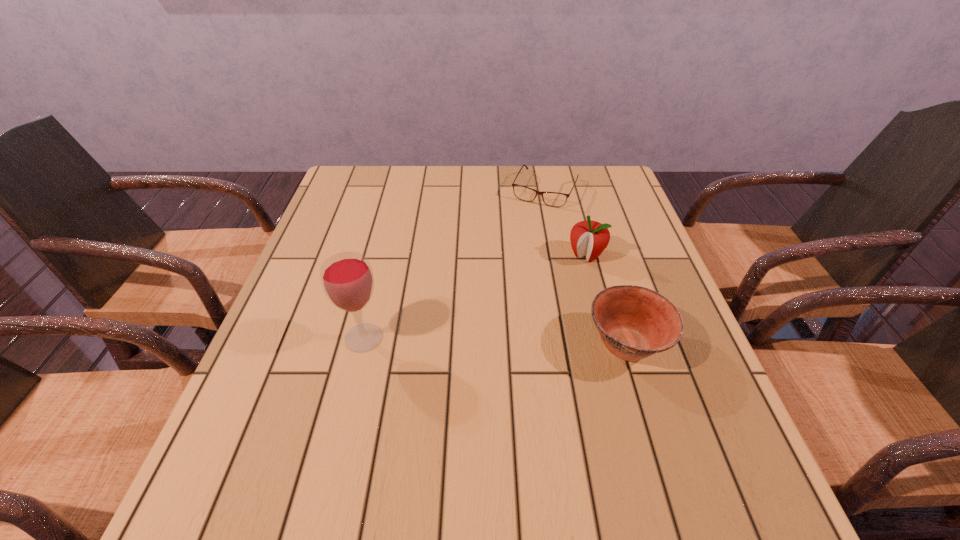
Locate an element on the screen. The image size is (960, 540). free space located on the side where a bite is taken out of the second farthest object is located at coordinates (540, 317).

Image resolution: width=960 pixels, height=540 pixels. Find the location of `free spot located on the side where a bite is taken out of the second farthest object`. free spot located on the side where a bite is taken out of the second farthest object is located at coordinates (569, 276).

You are a GUI agent. You are given a task and a screenshot of the screen. Output one action in this format:
    pyautogui.click(x=<x>, y=<y>)
    Task: Click on the vacant space located on the lenses of the farthest object
    This screenshot has width=960, height=540.
    Given the screenshot: What is the action you would take?
    pyautogui.click(x=516, y=245)

Locate an element on the screen. The width and height of the screenshot is (960, 540). vacant space located 0.360m on the lenses of the farthest object is located at coordinates (496, 286).

Locate an element on the screen. The width and height of the screenshot is (960, 540). free region located on the lenses of the farthest object is located at coordinates (494, 289).

The image size is (960, 540). Identify the location of object that is at the far edge. (554, 199).

Find the location of a particular element. The width and height of the screenshot is (960, 540). object that is positioned at the left edge is located at coordinates (347, 279).

Image resolution: width=960 pixels, height=540 pixels. What are the coordinates of `bowl that is positioned at the right edge` in the screenshot? It's located at (634, 322).

Find the location of `apple located in the right edge section of the desktop`. apple located in the right edge section of the desktop is located at coordinates (588, 238).

Find the location of a particular element. The width and height of the screenshot is (960, 540). spectacles located in the right edge section of the desktop is located at coordinates (554, 199).